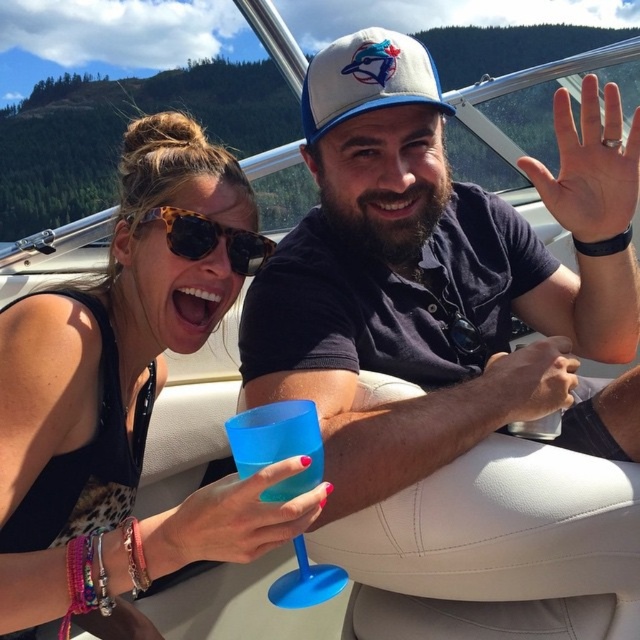
From the picture: You are a photographer taking a picture of the two people on the boat. You notice the tortoiseshell plastic sunglasses at upper center and the matte black watch at center. Which object is covering the other one?

The tortoiseshell plastic sunglasses at upper center is positioned over the matte black watch at center, so the sunglasses are covering the watch.

You are a photographer standing on the deck of the boat. You want to take a photo of the matte plastic cup at lower center and the white fabric baseball cap at center so that both are clearly visible in the frame. Given their current distance apart, will you need to zoom in or zoom out to ensure both objects are fully captured in the photo?

The matte plastic cup at lower center and white fabric baseball cap at center are 3.32 feet apart. To capture both objects in the frame, you would need to zoom out to ensure the entire distance between them fits within the photo.